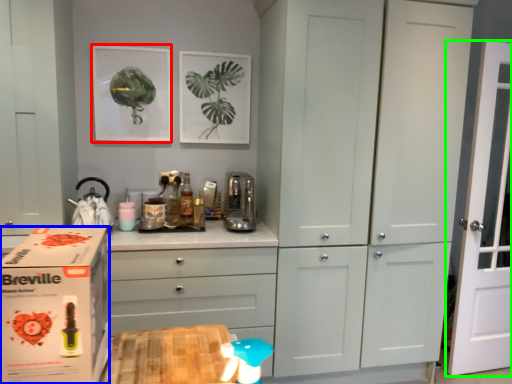
Question: Which is nearer to the picture frame (highlighted by a red box)? cardboard box (highlighted by a blue box) or door (highlighted by a green box).

Choices:
 (A) cardboard box
 (B) door

Answer: (A)